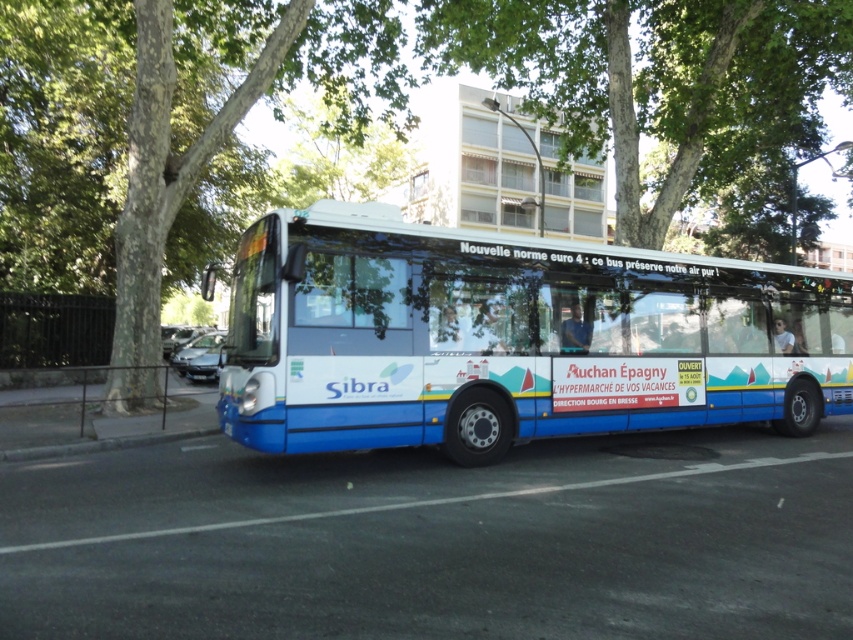
You are a photographer trying to capture the blue metallic bus at center and the green leafy tree at upper center in a single frame. Based on their sizes in the image, which one would appear smaller?

The blue metallic bus at center appears smaller than the green leafy tree at upper center in the image.

You are standing at the point marked by the coordinates [511,337] in the image. What object is exactly at this location?

The blue metallic bus at center is located at point [511,337].